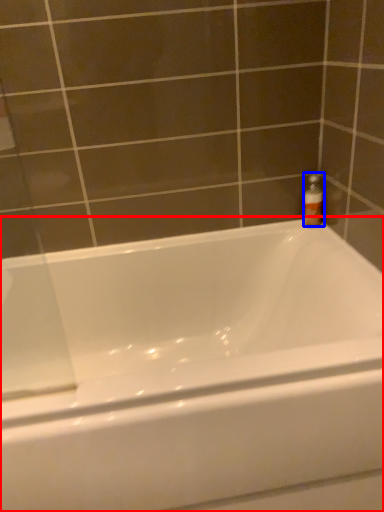
Question: Which object is closer to the camera taking this photo, bathtub (highlighted by a red box) or bottle (highlighted by a blue box)?

Choices:
 (A) bathtub
 (B) bottle

Answer: (A)